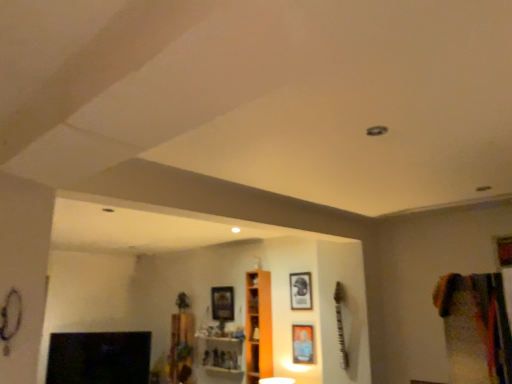
Question: Is matte black picture frame at center, the first picture frame from the right, bigger than orange wood cabinet at center?

Choices:
 (A) no
 (B) yes

Answer: (A)

Question: Is matte black picture frame at center, the first picture frame from the right, to the left of orange wood cabinet at center from the viewer's perspective?

Choices:
 (A) no
 (B) yes

Answer: (A)

Question: From a real-world perspective, is matte black picture frame at center, acting as the second picture frame starting from the back, positioned under orange wood cabinet at center based on gravity?

Choices:
 (A) yes
 (B) no

Answer: (B)

Question: Can you confirm if matte black picture frame at center, which is the third picture frame from left to right, is wider than orange wood cabinet at center?

Choices:
 (A) no
 (B) yes

Answer: (A)

Question: Is matte black picture frame at center, the first picture frame from the right, oriented away from orange wood cabinet at center?

Choices:
 (A) yes
 (B) no

Answer: (B)

Question: From the image's perspective, is wooden shelf at center, the 2th shelf from the right, above or below orange wood cabinet at center?

Choices:
 (A) above
 (B) below

Answer: (B)

Question: Visually, is wooden shelf at center, the 2th shelf from the right, positioned to the left or to the right of orange wood cabinet at center?

Choices:
 (A) left
 (B) right

Answer: (A)

Question: Choose the correct answer: Is wooden shelf at center, the 2th shelf from the right, inside orange wood cabinet at center or outside it?

Choices:
 (A) inside
 (B) outside

Answer: (B)

Question: Is point 175,367 closer or farther from the camera than point 246,331?

Choices:
 (A) farther
 (B) closer

Answer: (A)

Question: From a real-world perspective, is multicolored fabric at right positioned above or below wooden shelf at center, acting as the first shelf starting from the left?

Choices:
 (A) below
 (B) above

Answer: (B)

Question: Is multicolored fabric at right taller or shorter than wooden shelf at center, acting as the first shelf starting from the left?

Choices:
 (A) short
 (B) tall

Answer: (A)

Question: Is point (475, 322) closer or farther from the camera than point (179, 372)?

Choices:
 (A) farther
 (B) closer

Answer: (B)

Question: Considering their positions, is multicolored fabric at right located in front of or behind wooden shelf at center, the 2th shelf from the right?

Choices:
 (A) front
 (B) behind

Answer: (A)

Question: Based on their sizes in the image, would you say orange wood cabinet at center is bigger or smaller than wooden shelf at center, placed as the second shelf when sorted from left to right?

Choices:
 (A) big
 (B) small

Answer: (B)

Question: Considering the positions of orange wood cabinet at center and wooden shelf at center, placed as the second shelf when sorted from left to right, in the image, is orange wood cabinet at center taller or shorter than wooden shelf at center, placed as the second shelf when sorted from left to right,?

Choices:
 (A) short
 (B) tall

Answer: (B)